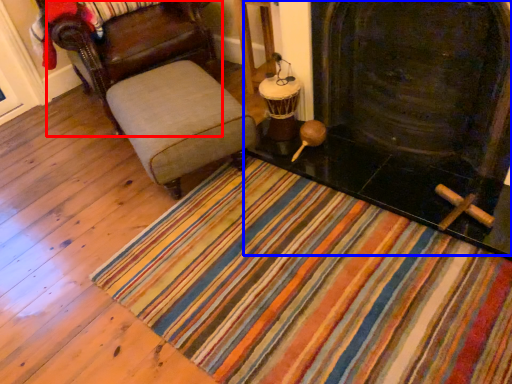
Question: Which object appears closest to the camera in this image, chair (highlighted by a red box) or fireplace (highlighted by a blue box)?

Choices:
 (A) chair
 (B) fireplace

Answer: (B)